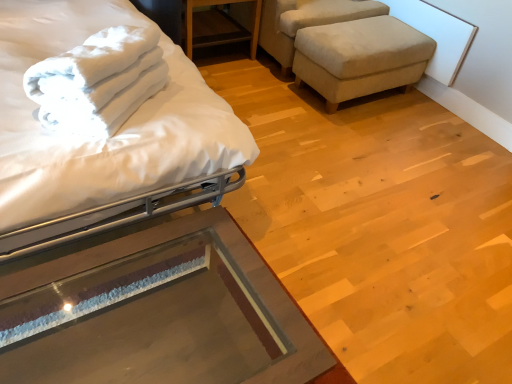
Question: From a real-world perspective, is beige fabric swivel chair at upper right below beige fabric stool at right?

Choices:
 (A) no
 (B) yes

Answer: (A)

Question: Is beige fabric swivel chair at upper right outside of beige fabric stool at right?

Choices:
 (A) no
 (B) yes

Answer: (B)

Question: From the image's perspective, does beige fabric swivel chair at upper right appear higher than beige fabric stool at right?

Choices:
 (A) yes
 (B) no

Answer: (A)

Question: Is beige fabric swivel chair at upper right turned away from beige fabric stool at right?

Choices:
 (A) yes
 (B) no

Answer: (B)

Question: Can you confirm if beige fabric swivel chair at upper right is taller than beige fabric stool at right?

Choices:
 (A) no
 (B) yes

Answer: (B)

Question: Does beige fabric swivel chair at upper right have a lesser height compared to beige fabric stool at right?

Choices:
 (A) yes
 (B) no

Answer: (B)

Question: Is beige fabric stool at right to the left of white matte bed at left from the viewer's perspective?

Choices:
 (A) no
 (B) yes

Answer: (A)

Question: From the image's perspective, is beige fabric stool at right above white matte bed at left?

Choices:
 (A) no
 (B) yes

Answer: (B)

Question: Is beige fabric stool at right thinner than white matte bed at left?

Choices:
 (A) no
 (B) yes

Answer: (B)

Question: Can white matte bed at left be found inside beige fabric stool at right?

Choices:
 (A) yes
 (B) no

Answer: (B)

Question: Is beige fabric stool at right looking in the opposite direction of white matte bed at left?

Choices:
 (A) no
 (B) yes

Answer: (A)

Question: Can you confirm if beige fabric stool at right is positioned to the right of white matte bed at left?

Choices:
 (A) no
 (B) yes

Answer: (B)

Question: Can white soft towel at upper left be found inside beige fabric stool at right?

Choices:
 (A) no
 (B) yes

Answer: (A)